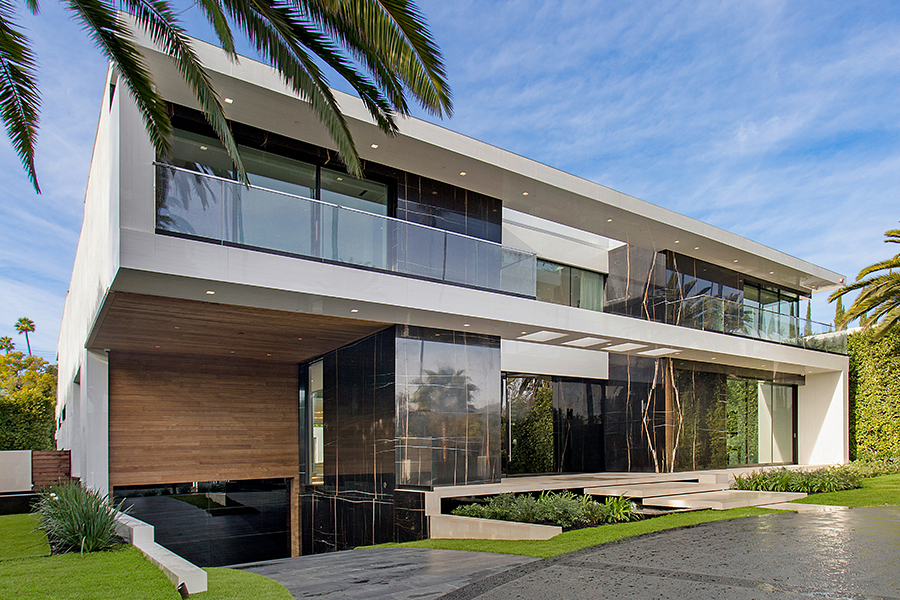
The width and height of the screenshot is (900, 600). I want to click on door, so click(585, 444).